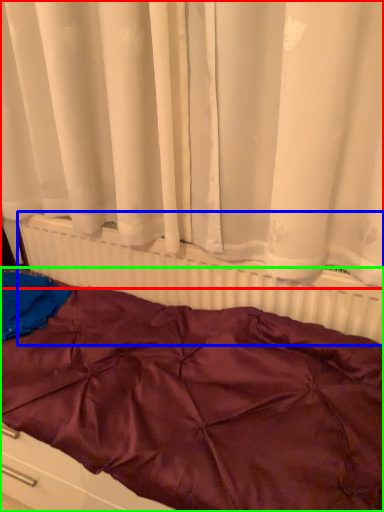
Question: Which is farther away from curtain (highlighted by a red box)? radiator (highlighted by a blue box) or furniture (highlighted by a green box)?

Choices:
 (A) radiator
 (B) furniture

Answer: (B)